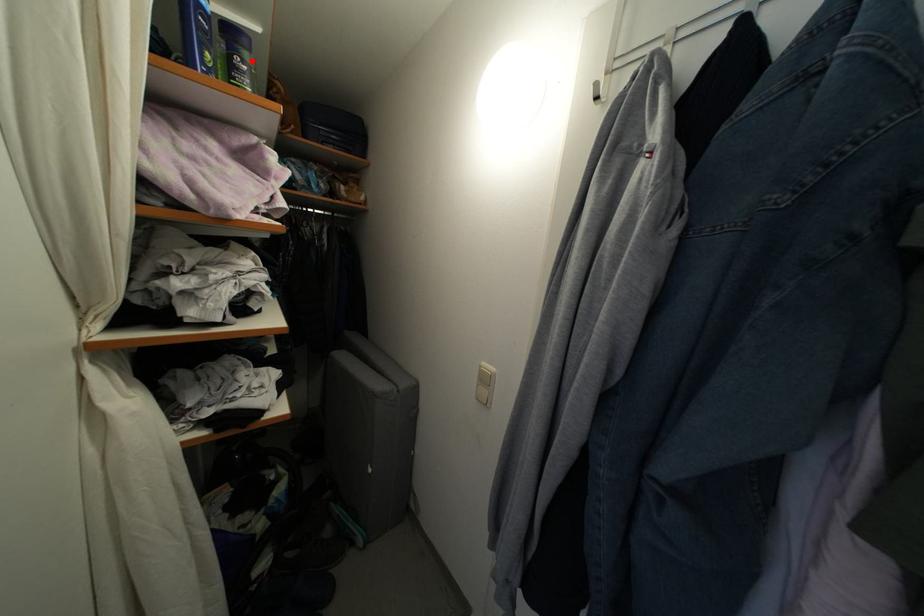
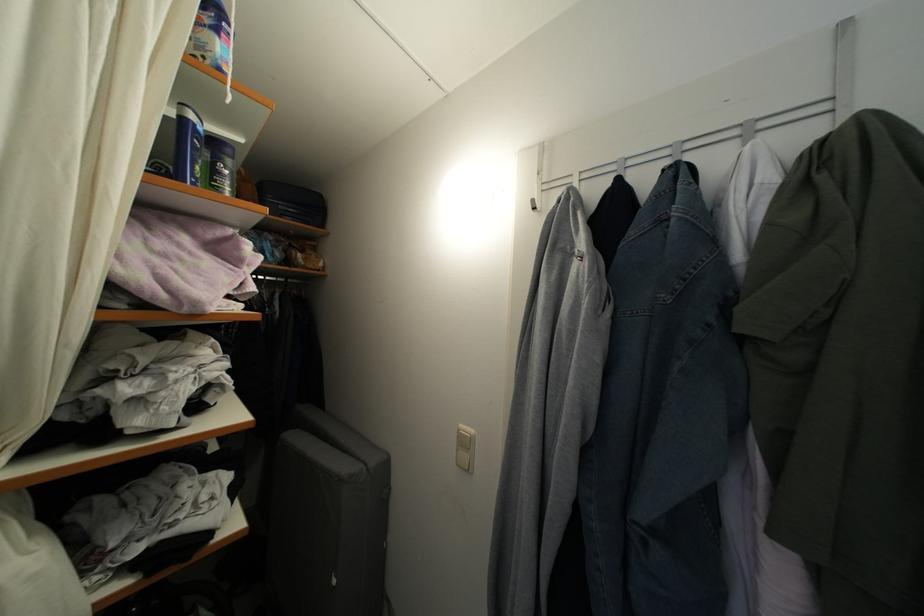
Where in the second image is the point corresponding to the highlighted location from the first image?

(235, 168)